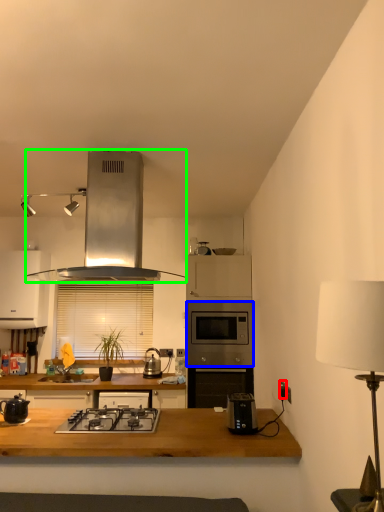
Question: Which is farther away from electric outlet (highlighted by a red box)? oven (highlighted by a blue box) or kitchen appliance (highlighted by a green box)?

Choices:
 (A) oven
 (B) kitchen appliance

Answer: (B)